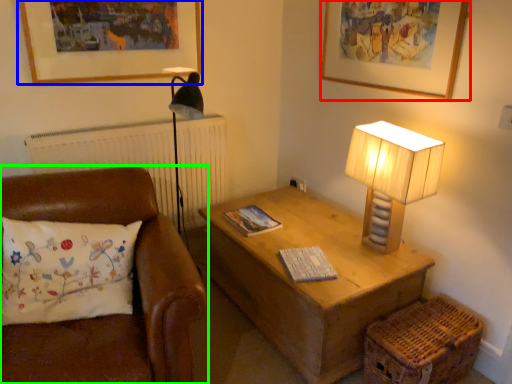
Question: Considering the real-world distances, which object is farthest from picture frame (highlighted by a red box)? picture frame (highlighted by a blue box) or studio couch (highlighted by a green box)?

Choices:
 (A) picture frame
 (B) studio couch

Answer: (B)